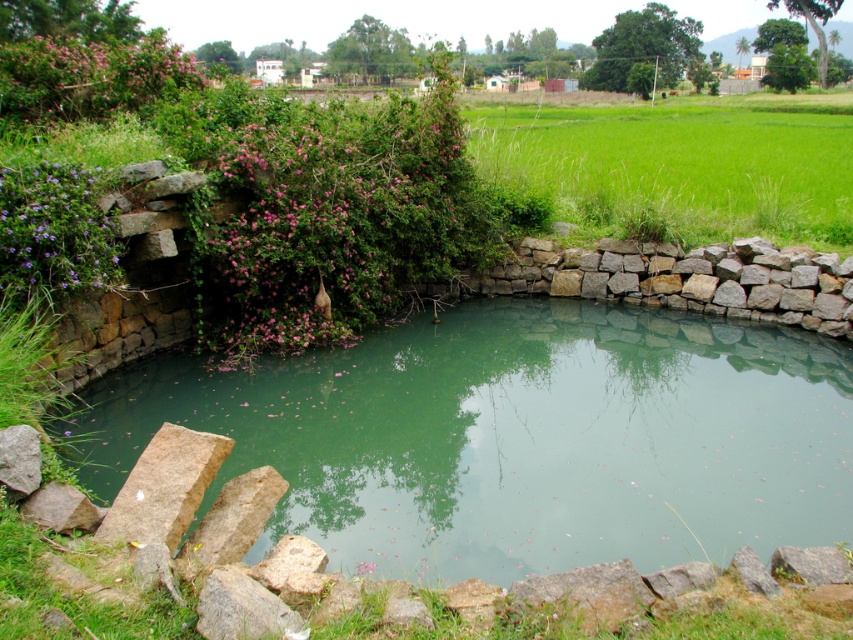
Consider the image. Can you confirm if green grassy field at upper right is wider than natural stone wall at right?

Correct, the width of green grassy field at upper right exceeds that of natural stone wall at right.

Who is lower down, green grassy field at upper right or natural stone wall at right?

natural stone wall at right

Does point (767, 124) come behind point (830, 333)?

Yes, point (767, 124) is behind point (830, 333).

The image size is (853, 640). I want to click on green grassy field at upper right, so click(x=677, y=168).

Is natural stone wall at right thinner than gray rough rock at lower left?

No.

Measure the distance between natural stone wall at right and gray rough rock at lower left.

natural stone wall at right is 8.15 meters from gray rough rock at lower left.

Between point (538, 266) and point (16, 480), which one is positioned in front?

Positioned in front is point (16, 480).

Locate an element on the screen. natural stone wall at right is located at coordinates (689, 280).

Does green stone water at center have a greater width compared to green grassy field at upper right?

No, green stone water at center is not wider than green grassy field at upper right.

Image resolution: width=853 pixels, height=640 pixels. Find the location of `green stone water at center`. green stone water at center is located at coordinates (515, 438).